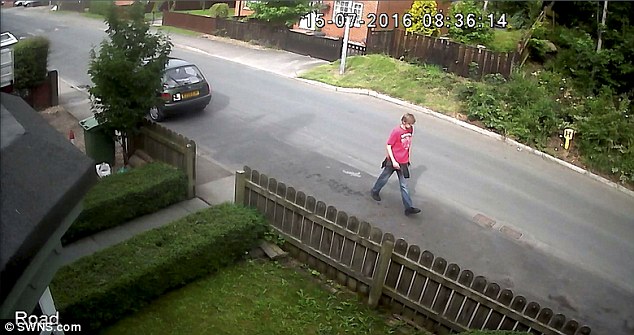
I want to click on window, so click(337, 2).